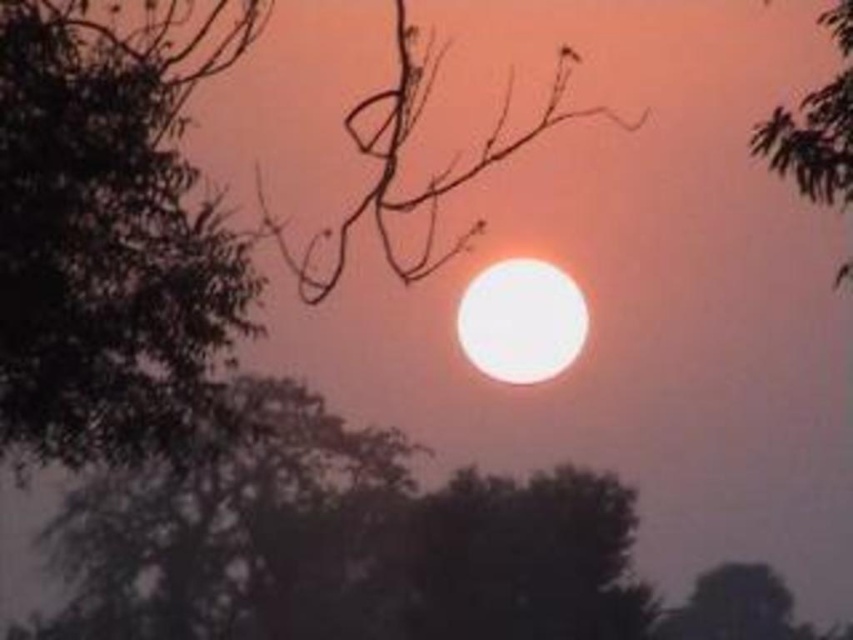
You are an artist trying to paint the sunset scene. You notice the green leafy tree at left and the brown matte branch at center. Which object should you paint first if you want to follow the rule of painting smaller objects before larger ones?

The green leafy tree at left should be painted first because it has a lesser width compared to the brown matte branch at center, making it smaller in size.

You are standing in the serene sunset scene and want to take a photo of the brown matte branch at center. If your camera has a maximum focus range of 12 meters, will it be able to focus on the branch?

The brown matte branch at center and camera are 12.46 meters apart from each other. Since the distance exceeds the camera maximum focus range of 12 meters, the camera cannot focus on the branch.

You are an artist trying to paint the sunset scene. You want to ensure the proportions of the brown matte branch at center and the green leafy tree at upper right are accurate. Which object should you paint as taller?

The brown matte branch at center should be painted as taller since it is taller than the green leafy tree at upper right according to the description.